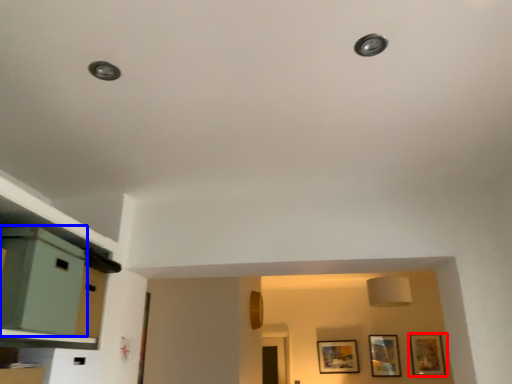
Question: Which object appears farthest to the camera in this image, picture frame (highlighted by a red box) or file cabinet (highlighted by a blue box)?

Choices:
 (A) picture frame
 (B) file cabinet

Answer: (A)